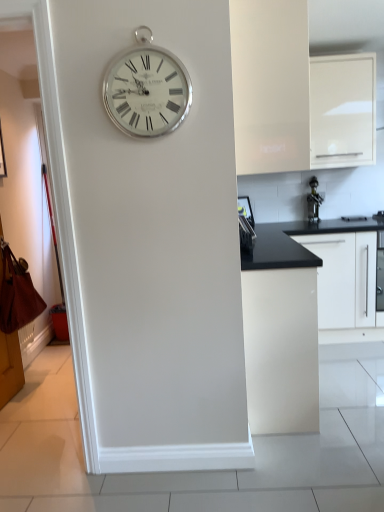
In order to face satin black knife block at right, which is the 1th appliance in front-to-back order, should I rotate leftwards or rightwards?

Turn right by 7.503 degrees to look at satin black knife block at right, which is the 1th appliance in front-to-back order.

The width and height of the screenshot is (384, 512). What do you see at coordinates (342, 110) in the screenshot? I see `white glossy cabinet at upper right, placed as the 3th cabinetry when sorted from left to right` at bounding box center [342, 110].

Image resolution: width=384 pixels, height=512 pixels. I want to click on silver metallic clock at upper center, so click(x=147, y=91).

Describe the element at coordinates (147, 91) in the screenshot. I see `silver metallic clock at upper center` at that location.

This screenshot has width=384, height=512. Identify the location of satin black knife block at right, the first appliance when ordered from left to right. (246, 225).

Which object is closer to the camera, metallic silver faucet at right, marked as the 2th appliance in a left-to-right arrangement, or white glossy cabinet at center, the third cabinetry when ordered from right to left?

Positioned in front is white glossy cabinet at center, the third cabinetry when ordered from right to left.

Looking at this image, who is smaller, metallic silver faucet at right, which appears as the first appliance when viewed from the back, or white glossy cabinet at center, the third cabinetry when ordered from right to left?

Smaller between the two is metallic silver faucet at right, which appears as the first appliance when viewed from the back.

Is white glossy cabinet at center, the third cabinetry when ordered from right to left, surrounded by metallic silver faucet at right, which appears as the first appliance when viewed from the back?

No.

Considering the relative sizes of metallic silver faucet at right, which appears as the first appliance when viewed from the back, and white glossy cabinet at center, the third cabinetry when ordered from right to left, in the image provided, is metallic silver faucet at right, which appears as the first appliance when viewed from the back, shorter than white glossy cabinet at center, the third cabinetry when ordered from right to left,?

Correct, metallic silver faucet at right, which appears as the first appliance when viewed from the back, is not as tall as white glossy cabinet at center, the third cabinetry when ordered from right to left.

Is white glossy cabinet at upper right, acting as the 2th cabinetry starting from the right, located within metallic silver faucet at right, marked as the 2th appliance in a left-to-right arrangement?

No, metallic silver faucet at right, marked as the 2th appliance in a left-to-right arrangement, does not contain white glossy cabinet at upper right, acting as the 2th cabinetry starting from the right.

Is metallic silver faucet at right, which appears as the first appliance when viewed from the right, looking in the opposite direction of white glossy cabinet at upper right, placed as the 3th cabinetry when sorted from left to right?

No, white glossy cabinet at upper right, placed as the 3th cabinetry when sorted from left to right, is not at the back of metallic silver faucet at right, which appears as the first appliance when viewed from the right.

From the image's perspective, starting from the white glossy cabinet at upper right, placed as the 3th cabinetry when sorted from left to right, which appliance is the 1st one below? Please provide its 2D coordinates.

[(314, 201)]

Considering the relative positions of metallic silver faucet at right, the 2th appliance positioned from the front, and white glossy cabinet at upper right, placed as the 3th cabinetry when sorted from left to right, in the image provided, is metallic silver faucet at right, the 2th appliance positioned from the front, to the left of white glossy cabinet at upper right, placed as the 3th cabinetry when sorted from left to right, from the viewer's perspective?

Correct, you'll find metallic silver faucet at right, the 2th appliance positioned from the front, to the left of white glossy cabinet at upper right, placed as the 3th cabinetry when sorted from left to right.

From the image's perspective, between white glossy cabinet at center, which ranks as the second cabinetry in left-to-right order, and satin black knife block at right, which appears as the 2th appliance when viewed from the right, who is located below?

white glossy cabinet at center, which ranks as the second cabinetry in left-to-right order, from the image's perspective.

I want to click on cabinetry that is the 2nd object directly below the satin black knife block at right, the first appliance when ordered from left to right (from a real-world perspective), so click(280, 333).

In the scene shown: Looking at their sizes, would you say white glossy cabinet at center, the third cabinetry when ordered from right to left, is wider or thinner than satin black knife block at right, which is the 1th appliance in front-to-back order?

In the image, white glossy cabinet at center, the third cabinetry when ordered from right to left, appears to be wider than satin black knife block at right, which is the 1th appliance in front-to-back order.

Which of these two, white glossy cabinet at center, the third cabinetry when ordered from right to left, or satin black knife block at right, the first appliance when ordered from left to right, stands shorter?

satin black knife block at right, the first appliance when ordered from left to right.

Considering the relative sizes of white matte cabinet at right, which is the 1th cabinetry in right-to-left order, and white glossy cabinet at center, the third cabinetry when ordered from right to left, in the image provided, is white matte cabinet at right, which is the 1th cabinetry in right-to-left order, bigger than white glossy cabinet at center, the third cabinetry when ordered from right to left,?

No, white matte cabinet at right, which is the 1th cabinetry in right-to-left order, is not bigger than white glossy cabinet at center, the third cabinetry when ordered from right to left.

Could you tell me if white matte cabinet at right, which is the 1th cabinetry in right-to-left order, is facing white glossy cabinet at center, the third cabinetry when ordered from right to left?

No.

Is white matte cabinet at right, acting as the 4th cabinetry starting from the left, not close to white glossy cabinet at center, the third cabinetry when ordered from right to left?

white matte cabinet at right, acting as the 4th cabinetry starting from the left, is far away from white glossy cabinet at center, the third cabinetry when ordered from right to left.

This screenshot has width=384, height=512. In order to click on cabinetry located underneath the white matte cabinet at right, acting as the 4th cabinetry starting from the left (from a real-world perspective) in this screenshot , I will do `click(280, 333)`.

Which is more to the right, white glossy cabinet at upper right, acting as the 2th cabinetry starting from the right, or metallic silver faucet at right, the 2th appliance positioned from the front?

white glossy cabinet at upper right, acting as the 2th cabinetry starting from the right, is more to the right.

How many degrees apart are the facing directions of white glossy cabinet at upper right, acting as the 2th cabinetry starting from the right, and metallic silver faucet at right, which appears as the first appliance when viewed from the back?

white glossy cabinet at upper right, acting as the 2th cabinetry starting from the right, and metallic silver faucet at right, which appears as the first appliance when viewed from the back, are facing 1.49 degrees away from each other.

From the picture: Considering the positions of objects white glossy cabinet at upper right, acting as the 2th cabinetry starting from the right, and metallic silver faucet at right, which appears as the first appliance when viewed from the back, in the image provided, who is behind, white glossy cabinet at upper right, acting as the 2th cabinetry starting from the right, or metallic silver faucet at right, which appears as the first appliance when viewed from the back,?

metallic silver faucet at right, which appears as the first appliance when viewed from the back, is further from the camera.

Consider the image. From a real-world perspective, does white glossy cabinet at upper right, acting as the 2th cabinetry starting from the right, sit lower than metallic silver faucet at right, the 2th appliance positioned from the front?

No, from a real-world perspective, white glossy cabinet at upper right, acting as the 2th cabinetry starting from the right, is not below metallic silver faucet at right, the 2th appliance positioned from the front.

From the image's perspective, relative to satin black knife block at right, which appears as the 2th appliance when viewed from the right, is white matte cabinet at right, which is the 1th cabinetry in right-to-left order, above or below?

white matte cabinet at right, which is the 1th cabinetry in right-to-left order, is situated lower than satin black knife block at right, which appears as the 2th appliance when viewed from the right, in the image.

Find the location of a particular element. The image size is (384, 512). the 1st cabinetry positioned below the satin black knife block at right, positioned as the 2th appliance in back-to-front order (from a real-world perspective) is located at coordinates (365, 279).

Is white matte cabinet at right, which is the 1th cabinetry in right-to-left order, to the left or to the right of satin black knife block at right, the first appliance when ordered from left to right, in the image?

Based on their positions, white matte cabinet at right, which is the 1th cabinetry in right-to-left order, is located to the right of satin black knife block at right, the first appliance when ordered from left to right.

Is point (358, 265) positioned in front of point (239, 228)?

No, (358, 265) is behind (239, 228).

Based on the photo, does white glossy cabinet at center, the third cabinetry when ordered from right to left, have a greater height compared to metallic silver faucet at right, the 2th appliance positioned from the front?

Yes.

There is a white glossy cabinet at center, which ranks as the second cabinetry in left-to-right order. Find the location of `the 2nd appliance above it (from the image's perspective)`. the 2nd appliance above it (from the image's perspective) is located at coordinates (314, 201).

Is white glossy cabinet at center, which ranks as the second cabinetry in left-to-right order, in front of or behind metallic silver faucet at right, the 2th appliance positioned from the front, in the image?

Visually, white glossy cabinet at center, which ranks as the second cabinetry in left-to-right order, is located in front of metallic silver faucet at right, the 2th appliance positioned from the front.

Can you confirm if white glossy cabinet at center, the third cabinetry when ordered from right to left, is positioned to the left of metallic silver faucet at right, the 2th appliance positioned from the front?

Yes, white glossy cabinet at center, the third cabinetry when ordered from right to left, is to the left of metallic silver faucet at right, the 2th appliance positioned from the front.

Find the location of a particular element. appliance to the right of white glossy cabinet at center, the third cabinetry when ordered from right to left is located at coordinates (314, 201).

The width and height of the screenshot is (384, 512). Find the location of `the 1st appliance located beneath the white glossy cabinet at upper right, placed as the 3th cabinetry when sorted from left to right (from a real-world perspective)`. the 1st appliance located beneath the white glossy cabinet at upper right, placed as the 3th cabinetry when sorted from left to right (from a real-world perspective) is located at coordinates (314, 201).

When comparing their distances from satin black knife block at right, which appears as the 2th appliance when viewed from the right, does metallic silver faucet at right, the 2th appliance positioned from the front, or white glossy cabinet at center, the third cabinetry when ordered from right to left, seem further?

The object further to satin black knife block at right, which appears as the 2th appliance when viewed from the right, is white glossy cabinet at center, the third cabinetry when ordered from right to left.

From the image, which object appears to be farther from satin black knife block at right, which is the 1th appliance in front-to-back order, white glossy cabinet at upper right, acting as the 2th cabinetry starting from the right, or metallic silver faucet at right, marked as the 2th appliance in a left-to-right arrangement?

white glossy cabinet at upper right, acting as the 2th cabinetry starting from the right, is positioned further to the anchor satin black knife block at right, which is the 1th appliance in front-to-back order.

Which object lies nearer to the anchor point white matte cabinet at upper center, which appears as the fourth cabinetry when viewed from the right, white glossy cabinet at center, which ranks as the second cabinetry in left-to-right order, or silver metallic clock at upper center?

silver metallic clock at upper center lies closer to white matte cabinet at upper center, which appears as the fourth cabinetry when viewed from the right, than the other object.

Looking at the image, which one is located closer to white glossy cabinet at upper right, acting as the 2th cabinetry starting from the right, satin black knife block at right, which is the 1th appliance in front-to-back order, or metallic silver faucet at right, which appears as the first appliance when viewed from the back?

Among the two, metallic silver faucet at right, which appears as the first appliance when viewed from the back, is located nearer to white glossy cabinet at upper right, acting as the 2th cabinetry starting from the right.

Estimate the real-world distances between objects in this image. Which object is further from satin black knife block at right, positioned as the 2th appliance in back-to-front order, white matte cabinet at upper center, which appears as the fourth cabinetry when viewed from the right, or white matte cabinet at right, which is the 1th cabinetry in right-to-left order?

Among the two, white matte cabinet at upper center, which appears as the fourth cabinetry when viewed from the right, is located further to satin black knife block at right, positioned as the 2th appliance in back-to-front order.

Looking at the image, which one is located further to white matte cabinet at upper center, positioned as the 1th cabinetry in left-to-right order, white glossy cabinet at upper right, acting as the 2th cabinetry starting from the right, or white matte cabinet at right, acting as the 4th cabinetry starting from the left?

white matte cabinet at right, acting as the 4th cabinetry starting from the left, is further to white matte cabinet at upper center, positioned as the 1th cabinetry in left-to-right order.

Based on their spatial positions, is metallic silver faucet at right, which appears as the first appliance when viewed from the right, or white matte cabinet at right, which is the 1th cabinetry in right-to-left order, closer to white matte cabinet at upper center, which appears as the fourth cabinetry when viewed from the right?

The object closer to white matte cabinet at upper center, which appears as the fourth cabinetry when viewed from the right, is white matte cabinet at right, which is the 1th cabinetry in right-to-left order.

Estimate the real-world distances between objects in this image. Which object is closer to metallic silver faucet at right, the 2th appliance positioned from the front, white glossy cabinet at upper right, acting as the 2th cabinetry starting from the right, or satin black knife block at right, the first appliance when ordered from left to right?

The object closer to metallic silver faucet at right, the 2th appliance positioned from the front, is white glossy cabinet at upper right, acting as the 2th cabinetry starting from the right.

Where is `appliance between white glossy cabinet at upper right, acting as the 2th cabinetry starting from the right, and satin black knife block at right, which is the 1th appliance in front-to-back order, in the up-down direction`? appliance between white glossy cabinet at upper right, acting as the 2th cabinetry starting from the right, and satin black knife block at right, which is the 1th appliance in front-to-back order, in the up-down direction is located at coordinates (314, 201).

The width and height of the screenshot is (384, 512). What are the coordinates of `wall clock between white matte cabinet at upper center, positioned as the 1th cabinetry in left-to-right order, and white glossy cabinet at center, which ranks as the second cabinetry in left-to-right order, in the up-down direction` in the screenshot? It's located at (147, 91).

Locate an element on the screen. This screenshot has width=384, height=512. appliance positioned between silver metallic clock at upper center and white glossy cabinet at upper right, placed as the 3th cabinetry when sorted from left to right, from near to far is located at coordinates (246, 225).

The width and height of the screenshot is (384, 512). Identify the location of appliance between silver metallic clock at upper center and metallic silver faucet at right, the 2th appliance positioned from the front, in the front-back direction. (246, 225).